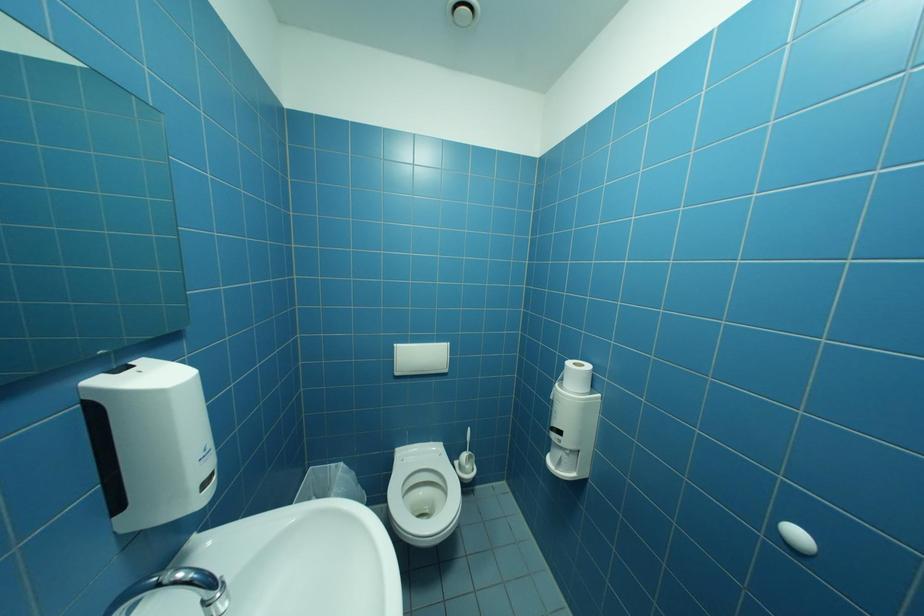
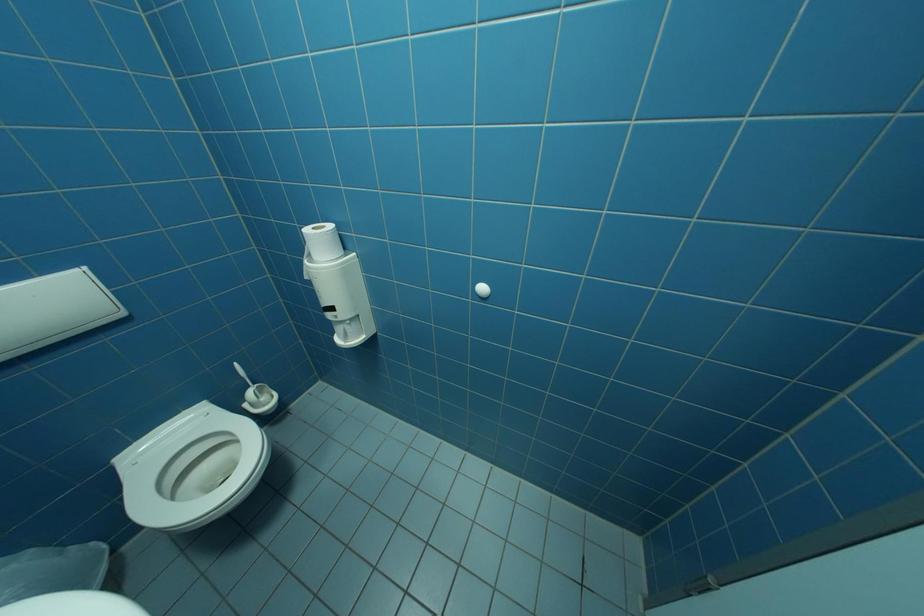
The first image is from the beginning of the video and the second image is from the end. How did the camera likely rotate when shooting the video?

The camera rotated toward right-down.